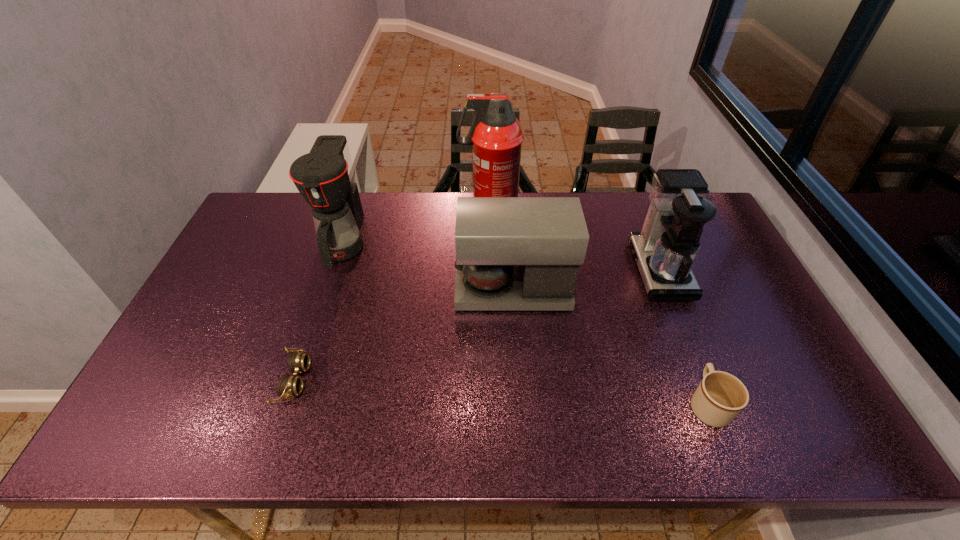
The image size is (960, 540). I want to click on blank area in the image that satisfies the following two spatial constraints: 1. through the lenses of the shortest object; 2. on the side of the second shortest object with the handle, so click(x=286, y=404).